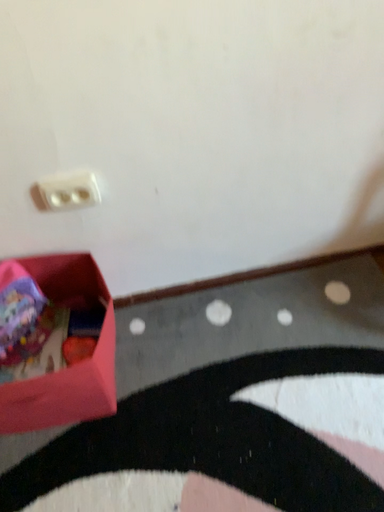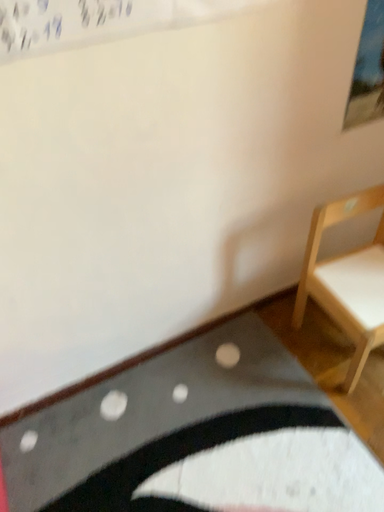
Question: How did the camera likely rotate when shooting the video?

Choices:
 (A) rotated upward
 (B) rotated downward

Answer: (A)